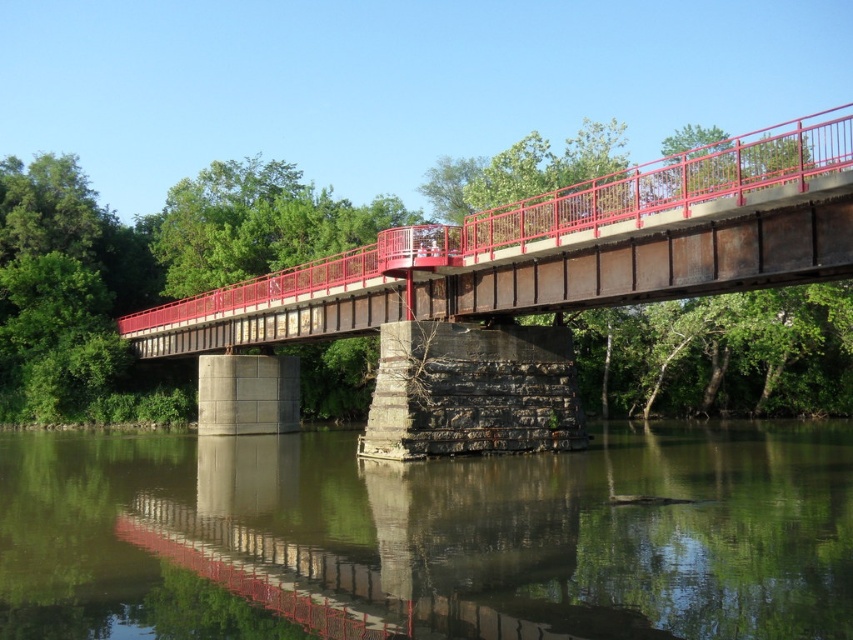
Consider the image. You are a photographer wanting to capture the rusty metal bridge at center and the green reflective water at lower center in one frame. Given their sizes, which object should you focus on first to ensure both are visible in the photo?

The green reflective water at lower center has a smaller size compared to the rusty metal bridge at center, so you should focus on the rusty metal bridge at center first to ensure both are visible in the photo.

You are standing on the pedestrian bridge and want to take a photo of the green reflective water at lower center. According to the scene description, where should you position yourself to capture the water in your shot?

The green reflective water at lower center is located at point (428, 536), so you should position yourself near the center of the bridge to capture the water in your shot.